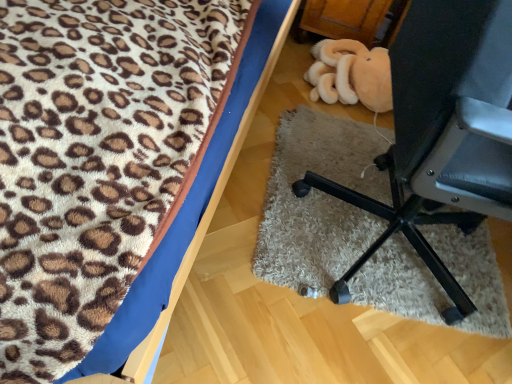
Question: Considering the relative sizes of leopard print fabric at upper left, the second furniture in the right-to-left sequence, and black plastic chair at lower right, arranged as the first furniture when viewed from the right, in the image provided, is leopard print fabric at upper left, the second furniture in the right-to-left sequence, bigger than black plastic chair at lower right, arranged as the first furniture when viewed from the right,?

Choices:
 (A) no
 (B) yes

Answer: (B)

Question: Can you confirm if leopard print fabric at upper left, the second furniture in the right-to-left sequence, is positioned to the left of black plastic chair at lower right, the second furniture positioned from the left?

Choices:
 (A) no
 (B) yes

Answer: (B)

Question: From a real-world perspective, is leopard print fabric at upper left, the second furniture in the right-to-left sequence, positioned under black plastic chair at lower right, the second furniture positioned from the left, based on gravity?

Choices:
 (A) no
 (B) yes

Answer: (B)

Question: Does leopard print fabric at upper left, the second furniture in the right-to-left sequence, appear on the right side of black plastic chair at lower right, the second furniture positioned from the left?

Choices:
 (A) no
 (B) yes

Answer: (A)

Question: From a real-world perspective, does leopard print fabric at upper left, the second furniture in the right-to-left sequence, stand above black plastic chair at lower right, the second furniture positioned from the left?

Choices:
 (A) no
 (B) yes

Answer: (A)

Question: Is leopard print fabric at upper left, the second furniture in the right-to-left sequence, thinner than black plastic chair at lower right, arranged as the first furniture when viewed from the right?

Choices:
 (A) no
 (B) yes

Answer: (A)

Question: Does black plastic chair at lower right, the second furniture positioned from the left, appear on the right side of leopard print fabric at upper left, the second furniture in the right-to-left sequence?

Choices:
 (A) yes
 (B) no

Answer: (A)

Question: From the image's perspective, is black plastic chair at lower right, arranged as the first furniture when viewed from the right, below leopard print fabric at upper left, the second furniture in the right-to-left sequence?

Choices:
 (A) no
 (B) yes

Answer: (B)

Question: From a real-world perspective, is black plastic chair at lower right, arranged as the first furniture when viewed from the right, positioned over leopard print fabric at upper left, the second furniture in the right-to-left sequence, based on gravity?

Choices:
 (A) yes
 (B) no

Answer: (A)

Question: Can you confirm if black plastic chair at lower right, arranged as the first furniture when viewed from the right, is bigger than leopard print fabric at upper left, the first furniture viewed from the left?

Choices:
 (A) yes
 (B) no

Answer: (B)

Question: From the image's perspective, does black plastic chair at lower right, the second furniture positioned from the left, appear higher than leopard print fabric at upper left, the second furniture in the right-to-left sequence?

Choices:
 (A) yes
 (B) no

Answer: (B)

Question: Is black plastic chair at lower right, arranged as the first furniture when viewed from the right, far away from leopard print fabric at upper left, the second furniture in the right-to-left sequence?

Choices:
 (A) no
 (B) yes

Answer: (A)

Question: Is leopard print fabric at upper left, the first furniture viewed from the left, in front of or behind black plastic chair at lower right, arranged as the first furniture when viewed from the right, in the image?

Choices:
 (A) front
 (B) behind

Answer: (A)